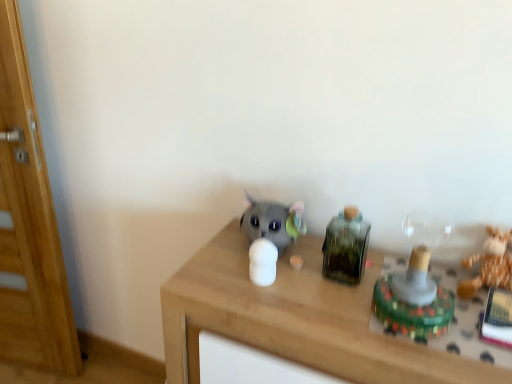
Identify the location of vacant point to the right of green glass bottle at center-right, positioned as the second toy in left-to-right order. (389, 268).